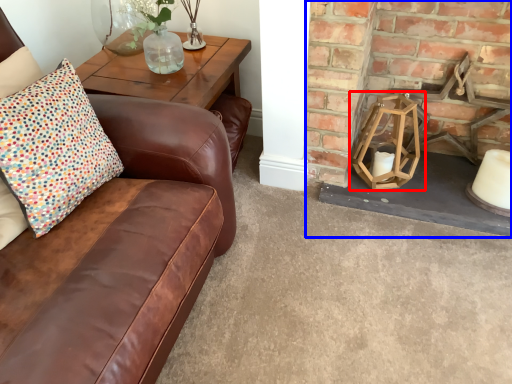
Question: Which object is further to the camera taking this photo, candle holder (highlighted by a red box) or fireplace (highlighted by a blue box)?

Choices:
 (A) candle holder
 (B) fireplace

Answer: (A)